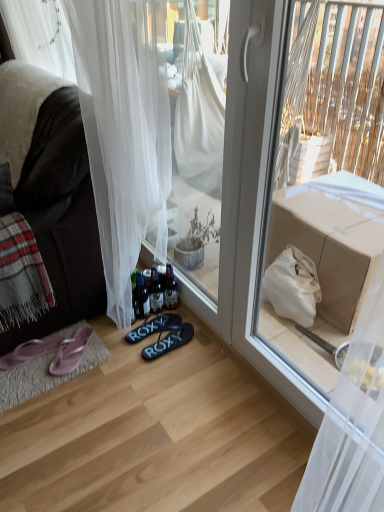
Question: Is translucent glass bottle at lower center, marked as the 1th bottle in a right-to-left arrangement, smaller than white sheer curtain at lower left?

Choices:
 (A) yes
 (B) no

Answer: (A)

Question: Can you confirm if translucent glass bottle at lower center, marked as the 1th bottle in a right-to-left arrangement, is taller than white sheer curtain at lower left?

Choices:
 (A) yes
 (B) no

Answer: (B)

Question: Considering the relative sizes of translucent glass bottle at lower center, marked as the 1th bottle in a right-to-left arrangement, and white sheer curtain at lower left in the image provided, is translucent glass bottle at lower center, marked as the 1th bottle in a right-to-left arrangement, bigger than white sheer curtain at lower left?

Choices:
 (A) no
 (B) yes

Answer: (A)

Question: Does translucent glass bottle at lower center, marked as the 1th bottle in a right-to-left arrangement, have a lesser height compared to white sheer curtain at lower left?

Choices:
 (A) yes
 (B) no

Answer: (A)

Question: Does translucent glass bottle at lower center, marked as the 2th bottle in a left-to-right arrangement, have a lesser width compared to white sheer curtain at lower left?

Choices:
 (A) no
 (B) yes

Answer: (B)

Question: Is translucent glass bottle at lower center, marked as the 2th bottle in a left-to-right arrangement, not within white sheer curtain at lower left?

Choices:
 (A) yes
 (B) no

Answer: (B)

Question: Are black rubber flip-flops at center, the first footwear viewed from the right, and translucent glass bottles at lower center, which is the 1th bottle in left-to-right order, beside each other?

Choices:
 (A) yes
 (B) no

Answer: (B)

Question: Can you confirm if black rubber flip-flops at center, the first footwear viewed from the right, is smaller than translucent glass bottles at lower center, which is the 1th bottle in left-to-right order?

Choices:
 (A) no
 (B) yes

Answer: (A)

Question: Could you tell me if black rubber flip-flops at center, the first footwear viewed from the right, is facing translucent glass bottles at lower center, which is the 1th bottle in left-to-right order?

Choices:
 (A) yes
 (B) no

Answer: (B)

Question: From a real-world perspective, is black rubber flip-flops at center, which is the fourth footwear from left to right, physically above translucent glass bottles at lower center, which is the 1th bottle in left-to-right order?

Choices:
 (A) yes
 (B) no

Answer: (B)

Question: From a real-world perspective, is black rubber flip-flops at center, which is the fourth footwear from left to right, positioned under translucent glass bottles at lower center, which appears as the 2th bottle when viewed from the right, based on gravity?

Choices:
 (A) yes
 (B) no

Answer: (A)

Question: Considering the relative sizes of black rubber flip-flops at center, which is the fourth footwear from left to right, and translucent glass bottles at lower center, which is the 1th bottle in left-to-right order, in the image provided, is black rubber flip-flops at center, which is the fourth footwear from left to right, thinner than translucent glass bottles at lower center, which is the 1th bottle in left-to-right order,?

Choices:
 (A) no
 (B) yes

Answer: (A)

Question: Does plaid woolen blanket at left appear on the right side of matte cardboard box at upper right?

Choices:
 (A) no
 (B) yes

Answer: (A)